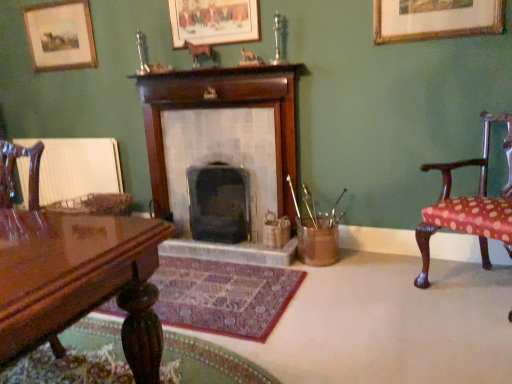
Question: From the image's perspective, is wooden fireplace at center, the 2th fireplace in the right-to-left sequence, located above or below matte wooden picture frame at upper left, which appears as the third picture frame when viewed from the right?

Choices:
 (A) below
 (B) above

Answer: (A)

Question: Would you say wooden fireplace at center, the 2th fireplace in the right-to-left sequence, is to the left or to the right of matte wooden picture frame at upper left, which is counted as the first picture frame, starting from the left, in the picture?

Choices:
 (A) right
 (B) left

Answer: (A)

Question: Which is farther from the shiny brown wood chair at left, which is the second chair from right to left?

Choices:
 (A) wooden picture frame at upper center, which is the 2th picture frame from left to right
 (B) matte wooden picture frame at upper left, the 1th picture frame from the back
 (C) wooden fireplace at center, the 2th fireplace in the right-to-left sequence
 (D) smooth gray stone fireplace at center, the 1th fireplace in the right-to-left sequence
 (E) gold-framed picture at upper right, arranged as the first picture frame when viewed from the front

Answer: (E)

Question: Which object is positioned closest to the smooth gray stone fireplace at center, the second fireplace from the left?

Choices:
 (A) gold-framed picture at upper right, which ranks as the 3th picture frame in back-to-front order
 (B) wooden picture frame at upper center, positioned as the second picture frame in right-to-left order
 (C) matte wooden picture frame at upper left, the 1th picture frame from the back
 (D) shiny brown wood chair at left, marked as the 1th chair in a left-to-right arrangement
 (E) polka dot fabric chair at right, the first chair viewed from the right

Answer: (B)